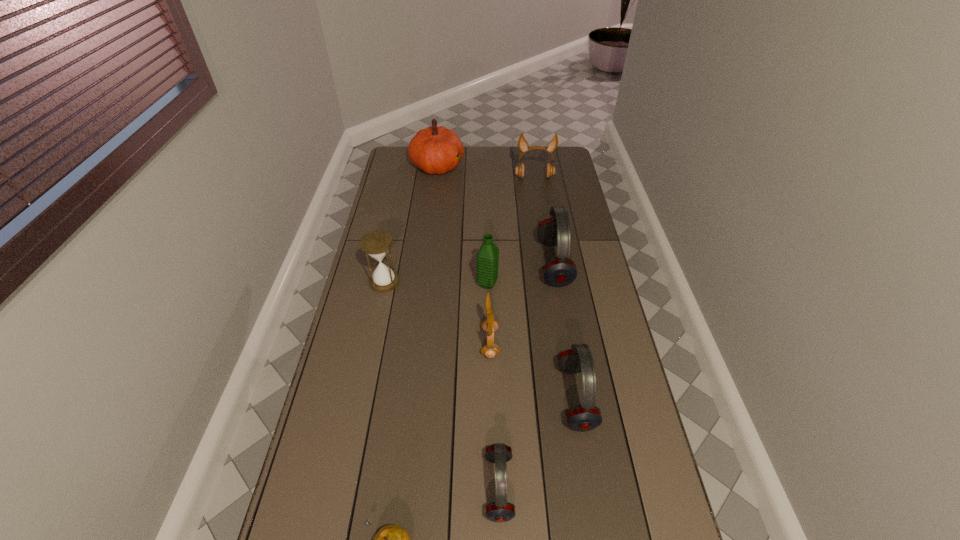
Where is `pumpkin present at the left edge`? This screenshot has width=960, height=540. pumpkin present at the left edge is located at coordinates (434, 150).

Identify the location of hourglass that is at the left edge. (376, 244).

The image size is (960, 540). I want to click on object present at the far left corner, so click(x=434, y=150).

Identify the location of blank space at the far edge of the desktop. (525, 167).

In the image, there is a desktop. Where is `vacant space at the left edge`? vacant space at the left edge is located at coordinates (404, 240).

You are a GUI agent. You are given a task and a screenshot of the screen. Output one action in this format:
    pyautogui.click(x=<x>, y=<y>)
    Task: Click on the vacant space at the right edge of the desktop
    Image resolution: width=960 pixels, height=540 pixels.
    Given the screenshot: What is the action you would take?
    pyautogui.click(x=575, y=184)

I want to click on free space at the far right corner of the desktop, so click(558, 161).

Locate an element on the screen. This screenshot has height=540, width=960. vacant area that lies between the green water bottle and the farthest red earphone is located at coordinates (520, 274).

Identify the location of vacant area between the third nearest object and the water bottle. Image resolution: width=960 pixels, height=540 pixels. (532, 341).

The width and height of the screenshot is (960, 540). Identify the location of free space that is in between the nearest earphone and the pumpkin. (468, 326).